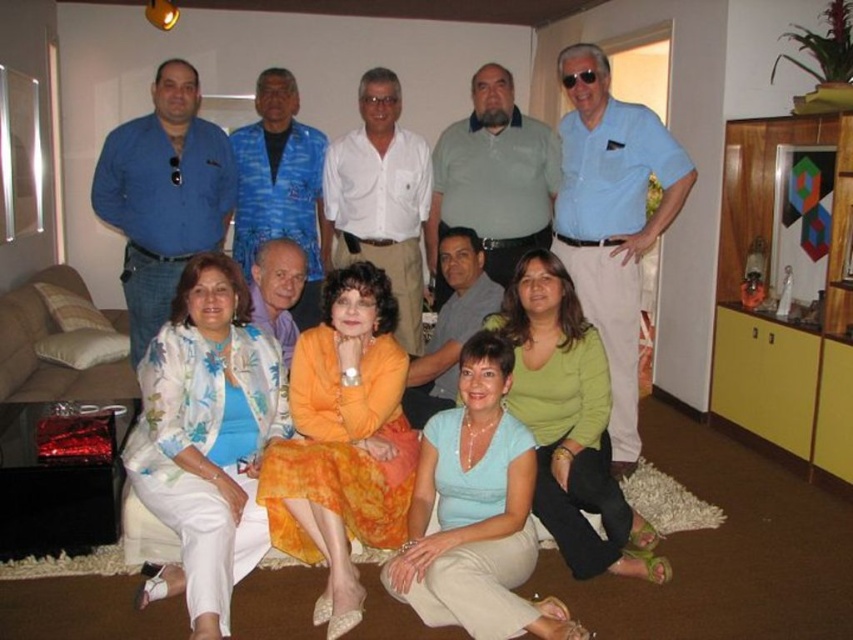
You are a photographer trying to capture a clear shot of the orange satin dress at center and the light blue jersey at center. Which one is taller in the image?

The orange satin dress at center is much taller than the light blue jersey at center.

You are a photographer trying to adjust the lighting for a photo shoot. You notice the orange satin dress at center and the light blue jersey at center. Which one is covering part of the other?

The orange satin dress at center is positioned over light blue jersey at center, so it is covering part of it.